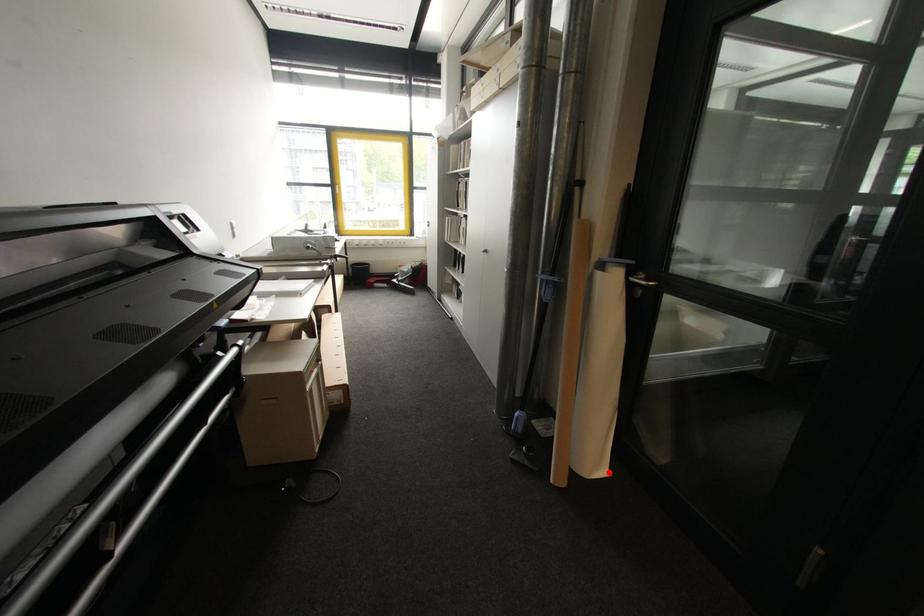
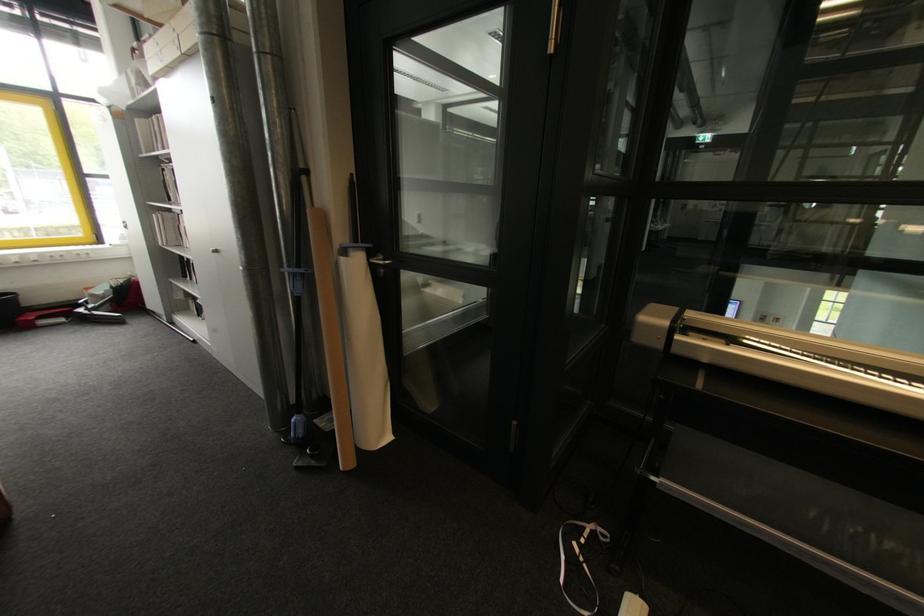
Question: I am providing you with two images of the same scene from different viewpoints. Image1 has a red point marked. In image2, the corresponding 3D location appears at what relative position? Reply with the corresponding letter.

Choices:
 (A) Closer
 (B) Farther

Answer: (A)